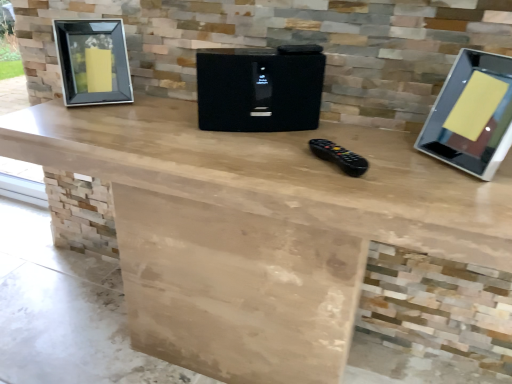
Question: Is silver glossy monitor at right completely or partially outside of black textured speaker at center?

Choices:
 (A) yes
 (B) no

Answer: (A)

Question: From a real-world perspective, is silver glossy monitor at right under black textured speaker at center?

Choices:
 (A) yes
 (B) no

Answer: (B)

Question: Is the position of silver glossy monitor at right less distant than that of black textured speaker at center?

Choices:
 (A) no
 (B) yes

Answer: (B)

Question: From the image's perspective, does silver glossy monitor at right appear lower than black textured speaker at center?

Choices:
 (A) yes
 (B) no

Answer: (A)

Question: Can you confirm if silver glossy monitor at right is thinner than black textured speaker at center?

Choices:
 (A) yes
 (B) no

Answer: (B)

Question: In terms of height, does black glass picture frame at left look taller or shorter compared to black plastic remote control at center?

Choices:
 (A) tall
 (B) short

Answer: (A)

Question: From the image's perspective, relative to black plastic remote control at center, is black glass picture frame at left above or below?

Choices:
 (A) above
 (B) below

Answer: (A)

Question: Is point [105, 61] positioned closer to the camera than point [309, 145]?

Choices:
 (A) closer
 (B) farther

Answer: (B)

Question: Which is correct: black glass picture frame at left is inside black plastic remote control at center, or outside of it?

Choices:
 (A) outside
 (B) inside

Answer: (A)

Question: Visually, is black textured speaker at center positioned to the left or to the right of silver glossy monitor at right?

Choices:
 (A) right
 (B) left

Answer: (B)

Question: Is black textured speaker at center taller or shorter than silver glossy monitor at right?

Choices:
 (A) tall
 (B) short

Answer: (B)

Question: From a real-world perspective, is black textured speaker at center positioned above or below silver glossy monitor at right?

Choices:
 (A) below
 (B) above

Answer: (A)

Question: Looking at their shapes, would you say black textured speaker at center is wider or thinner than silver glossy monitor at right?

Choices:
 (A) thin
 (B) wide

Answer: (A)

Question: In terms of width, does black plastic remote control at center look wider or thinner when compared to black textured speaker at center?

Choices:
 (A) wide
 (B) thin

Answer: (B)

Question: In terms of size, does black plastic remote control at center appear bigger or smaller than black textured speaker at center?

Choices:
 (A) big
 (B) small

Answer: (B)